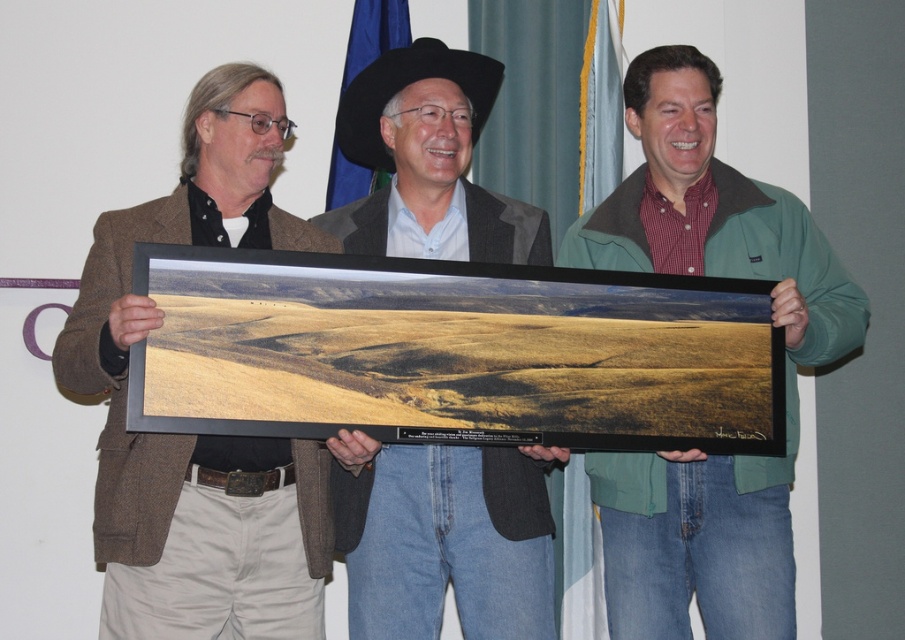
Is matte black cowboy hat at center positioned in front of black felt cowboy hat at center?

That is True.

Between matte black cowboy hat at center and black felt cowboy hat at center, which one is positioned lower?

matte black cowboy hat at center

Is point (467, 592) farther from viewer compared to point (464, 51)?

No, it is not.

Identify the location of matte black cowboy hat at center. The width and height of the screenshot is (905, 640). (450, 541).

Does point (594, 452) come behind point (348, 90)?

No, it is in front of (348, 90).

Is point (777, 490) closer to viewer compared to point (372, 93)?

Yes, point (777, 490) is closer to viewer.

You are a GUI agent. You are given a task and a screenshot of the screen. Output one action in this format:
    pyautogui.click(x=<x>, y=<y>)
    Task: Click on the green textured jacket at center
    
    Given the screenshot: What is the action you would take?
    pyautogui.click(x=786, y=368)

Does green textured jacket at center have a larger size compared to matte black cowboy hat at center?

Correct, green textured jacket at center is larger in size than matte black cowboy hat at center.

How much distance is there between green textured jacket at center and matte black cowboy hat at center?

18.32 inches

Is point (794, 572) positioned after point (468, 449)?

That is True.

Where is `green textured jacket at center`? The image size is (905, 640). green textured jacket at center is located at coordinates (786, 368).